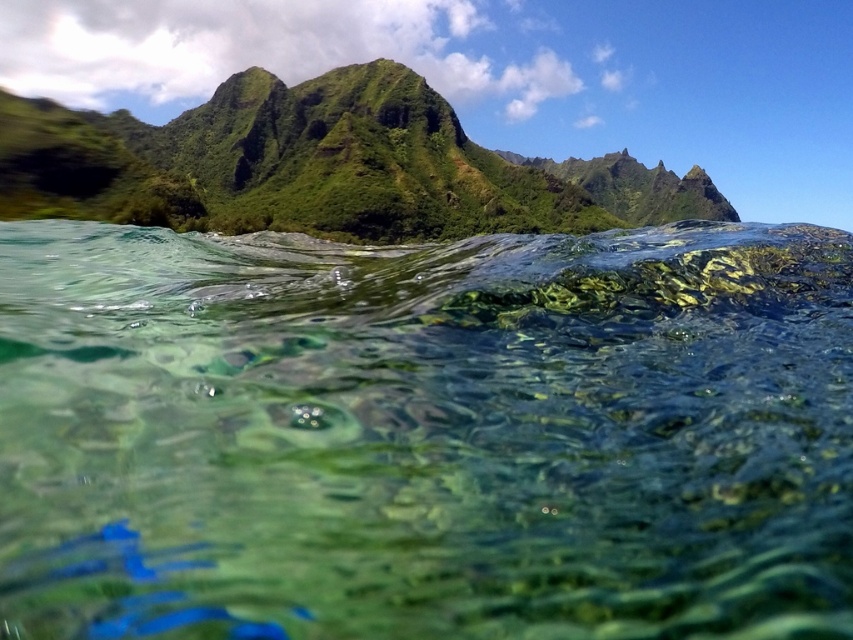
You are a diver exploring the underwater scene and want to swim towards the green grassy mountain at upper center. Which direction should you swim to reach it from the clear glassy water at center?

You should swim to the right from the clear glassy water at center to reach the green grassy mountain at upper center since the clear glassy water at center is to the left of the green grassy mountain at upper center.

You are a diver swimming underwater and want to reach the surface. Looking at the image, which object, the clear glassy water at center or the green grassy mountain at upper center, is located above the other?

The green grassy mountain at upper center is above the clear glassy water at center because the clear glassy water at center is positioned under it.

You are a diver with a 30 feet air supply remaining. You are currently at the surface and want to reach the point marked at coordinates point (521, 538). Can you safely reach that point with your current air supply?

The distance between you and point (521, 538) is 28.36 feet, so yes, you can safely reach it with your remaining 30 feet of air supply since it is within the available range.